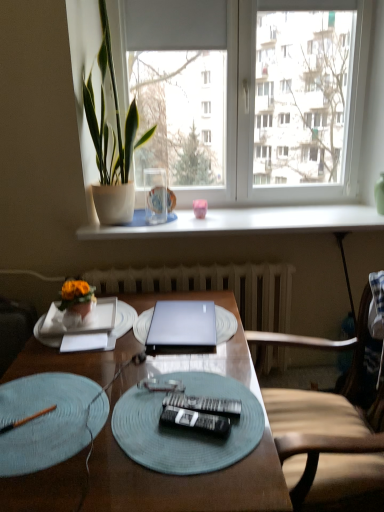
What are the coordinates of `unoccupied space behind orange wood pen at lower left` in the screenshot? It's located at (50, 386).